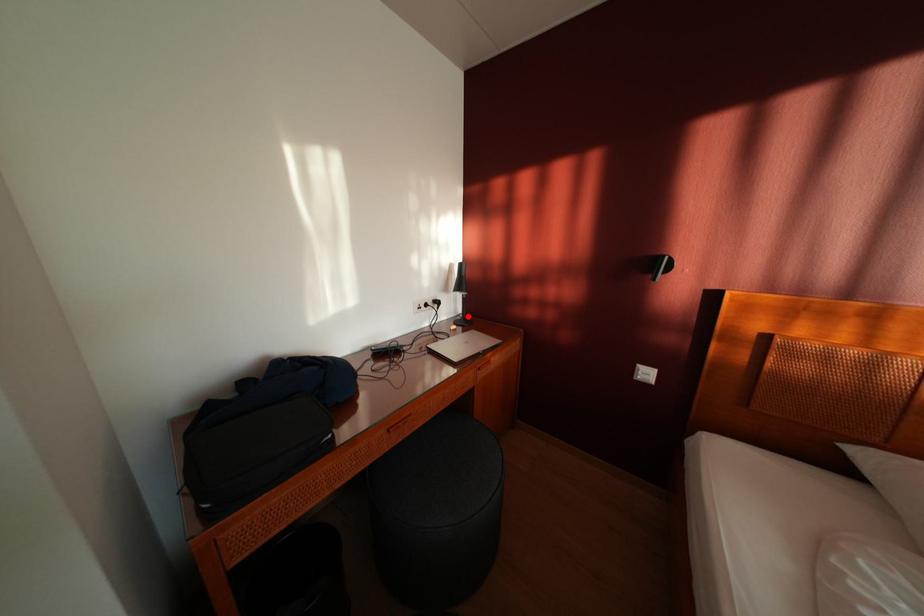
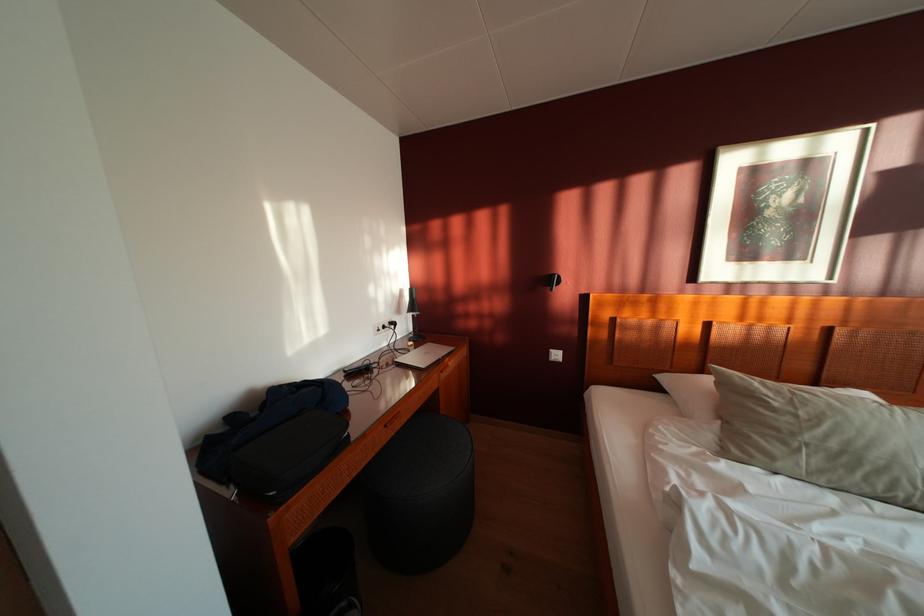
The point at the highlighted location is marked in the first image. Where is the corresponding point in the second image?

(419, 334)